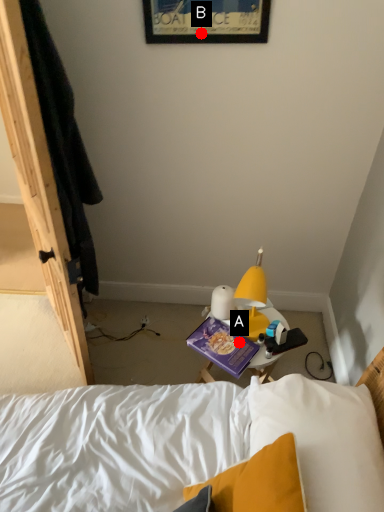
Question: Two points are circled on the image, labeled by A and B beside each circle. Which point is closer to the camera taking this photo?

Choices:
 (A) A is closer
 (B) B is closer

Answer: (B)